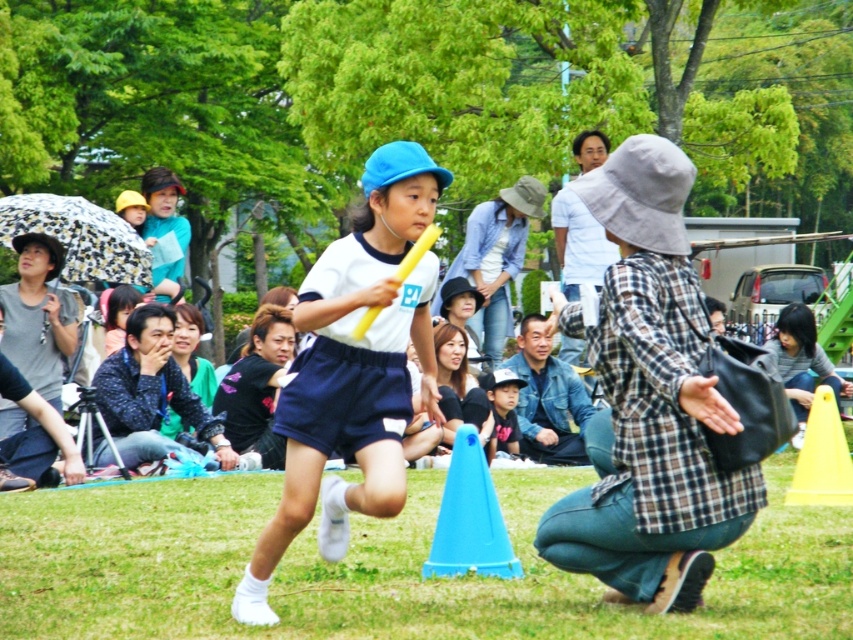
You are a photographer trying to capture the child running with the baton. You notice the green grass at center and the matte black cap at center in your viewfinder. Which object should you focus on to ensure the child is in sharp focus?

To ensure the child is in sharp focus, focus on the matte black cap at center because it is closer to the camera than the green grass at center, which is further away.

From the picture: You are organizing a relay race in the park and need to place two traffic cones as markers. The blue plastic traffic cone at center and the yellow plastic traffic cone at lower right must be positioned such that the wider cone is closer to the finish line. Based on the image, which cone should be placed closer to the finish line?

The yellow plastic traffic cone at lower right should be placed closer to the finish line because its width is greater than the blue plastic traffic cone at center.